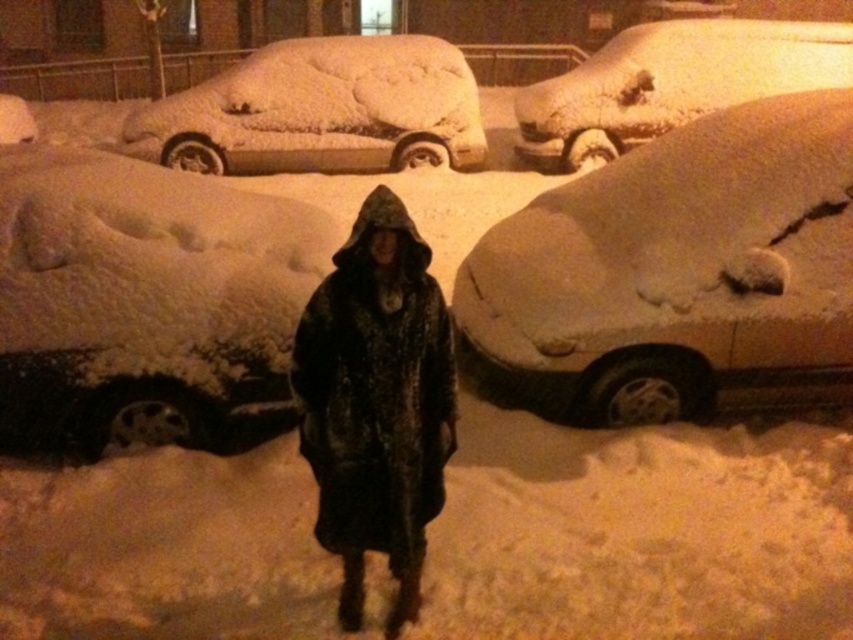
Between snow-covered car at upper left and snow-covered car at upper right, which one has less height?

snow-covered car at upper left

In the scene shown: Who is positioned more to the right, snow-covered car at upper left or snow-covered car at upper right?

snow-covered car at upper right is more to the right.

Locate an element on the screen. Image resolution: width=853 pixels, height=640 pixels. snow-covered car at upper left is located at coordinates (322, 109).

Is snow-covered car at right thinner than snow-covered car at upper right?

Correct, snow-covered car at right's width is less than snow-covered car at upper right's.

Between point (830, 381) and point (662, 84), which one is positioned in front?

Point (830, 381)

Between point (770, 164) and point (605, 72), which one is positioned behind?

Point (605, 72)

Locate an element on the screen. snow-covered car at right is located at coordinates (682, 269).

Is snow-covered car at right positioned before white fluffy snow at left?

Yes, it is in front of white fluffy snow at left.

Is snow-covered car at right bigger than white fluffy snow at left?

Yes, snow-covered car at right is bigger than white fluffy snow at left.

At what (x,y) coordinates should I click in order to perform the action: click on snow-covered car at right. Please return your answer as a coordinate pair (x, y). Looking at the image, I should click on [682, 269].